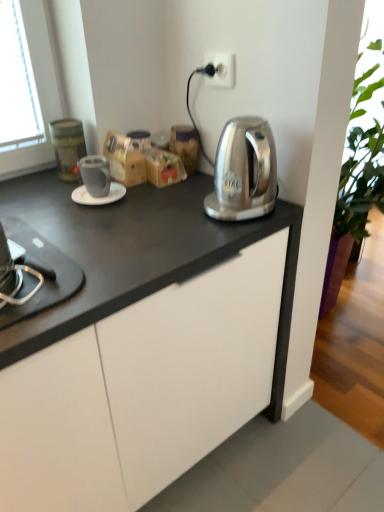
Image resolution: width=384 pixels, height=512 pixels. Identify the location of free point to the left of satin silver kettle at center. (174, 212).